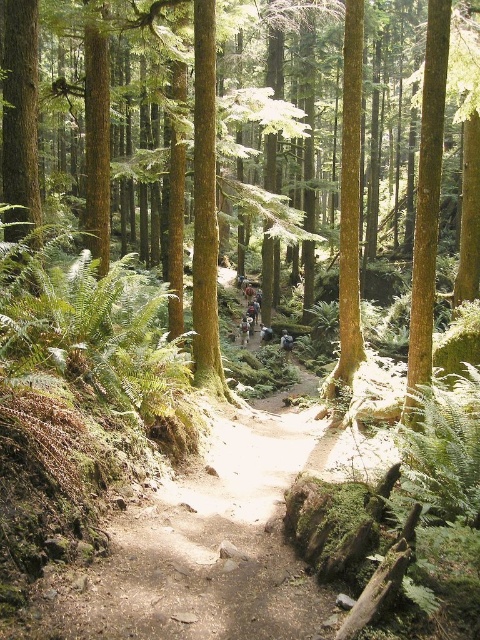
Which of these two, green rough bark tree at center or smooth brown tree trunk at center, stands taller?

With more height is smooth brown tree trunk at center.

Is green rough bark tree at center closer to camera compared to smooth brown tree trunk at center?

Yes.

Locate an element on the screen. The image size is (480, 640). green rough bark tree at center is located at coordinates (428, 202).

Does point (290, 20) lie behind point (440, 180)?

Yes, it is behind point (440, 180).

Which of these two, green matte tree at center or green rough bark tree at center, stands shorter?

green rough bark tree at center is shorter.

In order to click on green matte tree at center in this screenshot , I will do `click(389, 118)`.

Is point (32, 353) positioned behind point (441, 10)?

No, (32, 353) is closer to viewer.

Who is taller, green leafy fern at left or green rough bark tree at center?

green rough bark tree at center is taller.

Locate an element on the screen. This screenshot has height=640, width=480. green leafy fern at left is located at coordinates coord(91,328).

You are a GUI agent. You are given a task and a screenshot of the screen. Output one action in this format:
    pyautogui.click(x=<x>, y=<y>)
    Task: Click on the green leafy fern at left
    
    Given the screenshot: What is the action you would take?
    pyautogui.click(x=91, y=328)